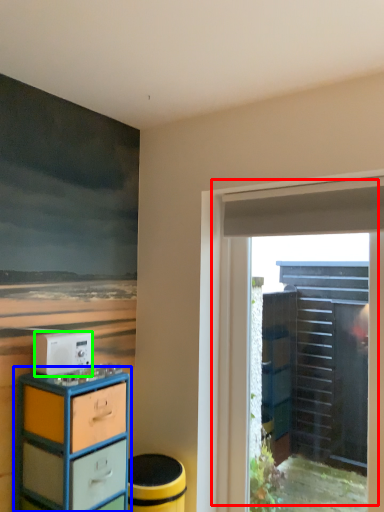
Question: Based on their relative distances, which object is nearer to door (highlighted by a red box)? Choose from chest of drawers (highlighted by a blue box) and appliance (highlighted by a green box).

Choices:
 (A) chest of drawers
 (B) appliance

Answer: (A)